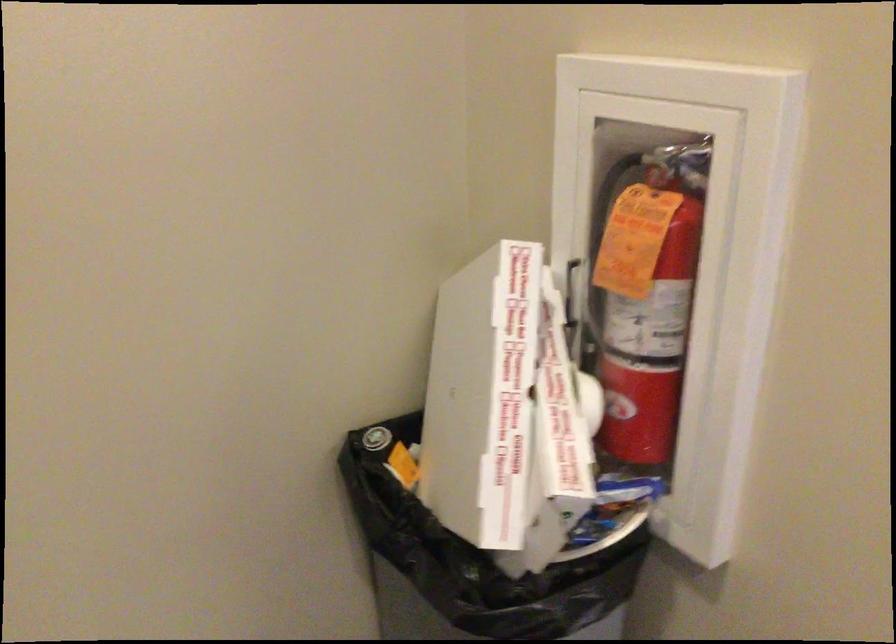
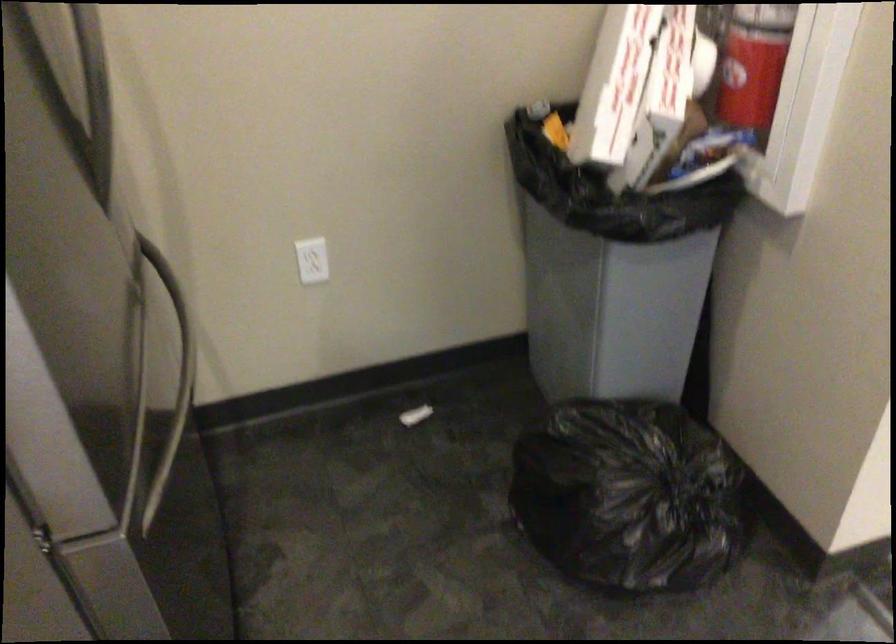
In the second image, find the point that corresponds to (x=558, y=427) in the first image.

(670, 64)